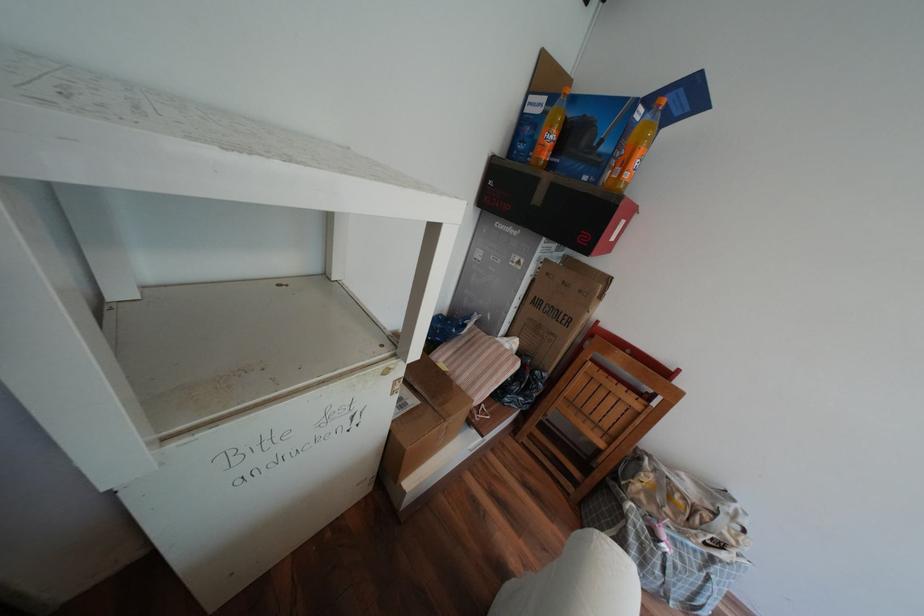
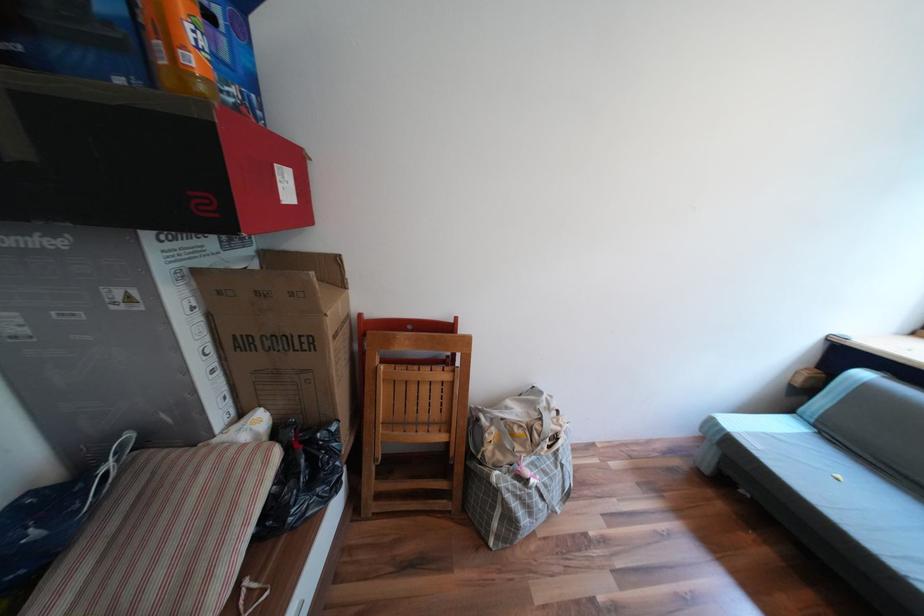
Find the pixel in the second image that matches [517,360] in the first image.

(258, 464)